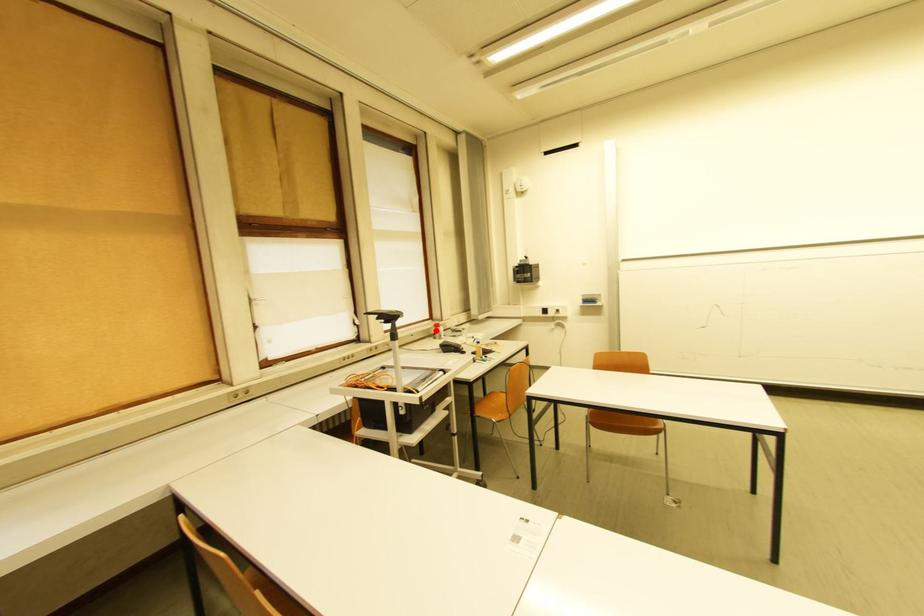
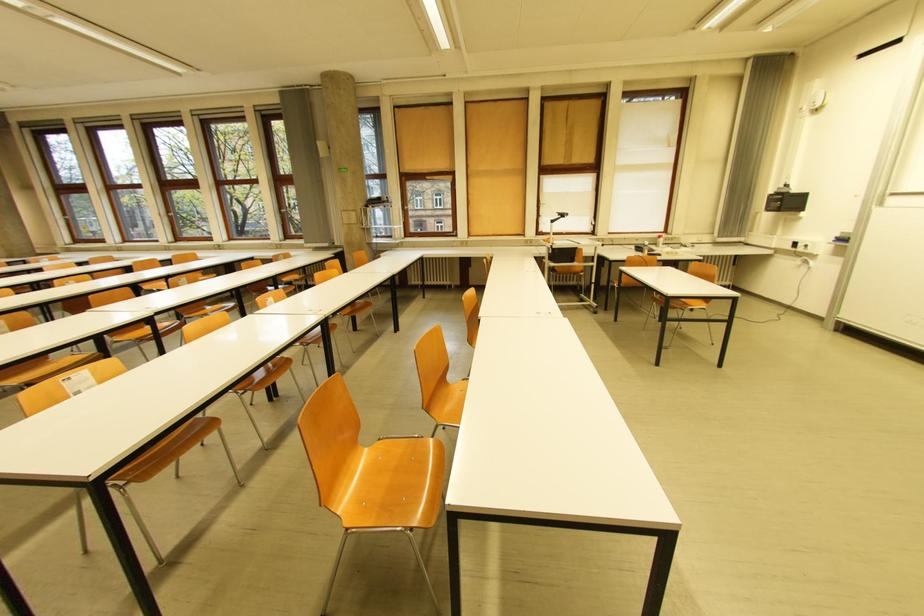
Find the pixel in the second image that matches the highlighted location in the first image.

(662, 240)